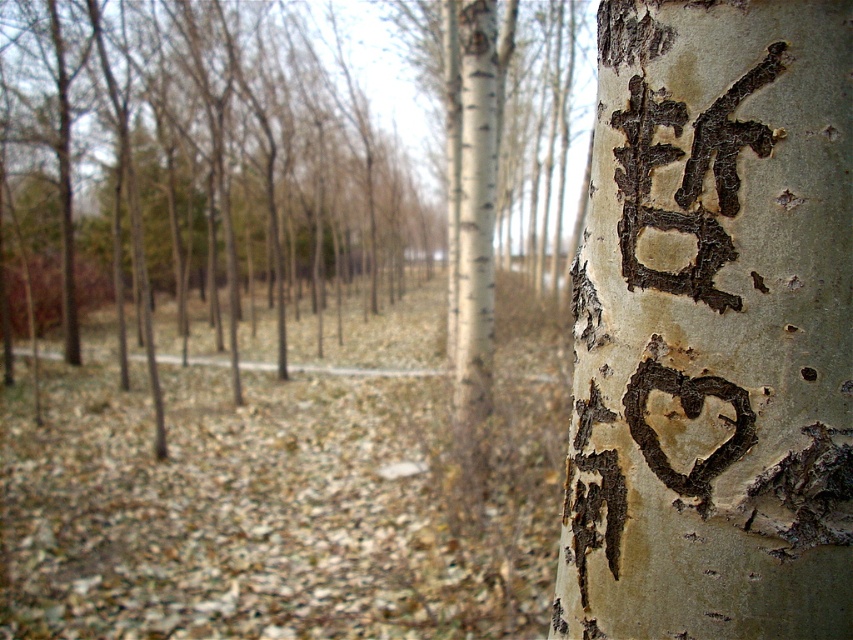
You are an artist standing in the forest scene. You want to sketch the smooth white bark at center and the black bark writing at upper right. Which object should you focus on first to capture their relative positions accurately?

You should focus on the smooth white bark at center first since it is closer to the viewer than the black bark writing at upper right, allowing you to establish the foreground before adding background details.

You are an artist planning to paint the forest scene. You want to ensure the smooth white bark at center and the black bark writing at upper right are proportionally accurate. Which object should you make larger in your painting?

The smooth white bark at center should be made larger than the black bark writing at upper right in the painting since it is bigger than the latter according to the description.